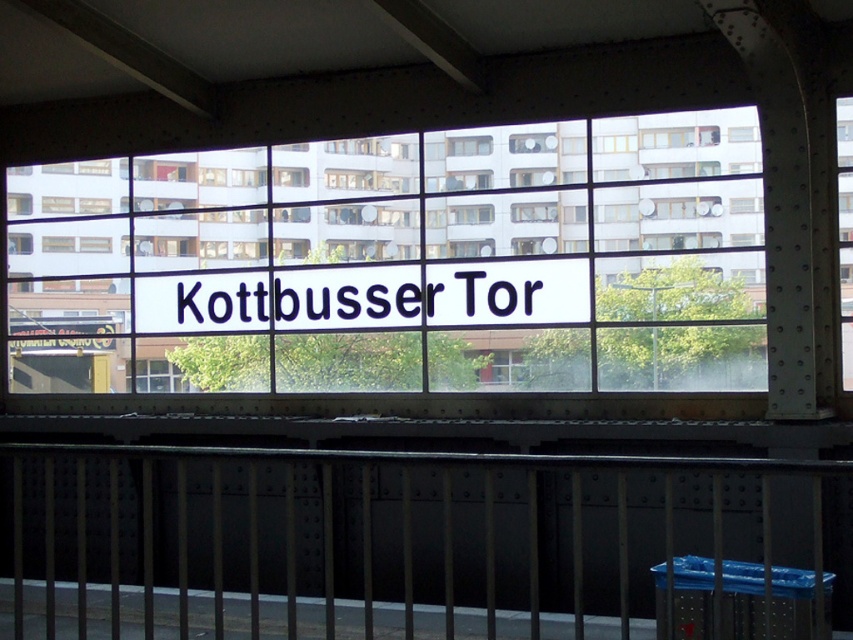
Is transparent glass sign at center above black metal rail at center?

Indeed, transparent glass sign at center is positioned over black metal rail at center.

Is point (24, 280) closer to camera compared to point (561, 580)?

No, it is behind (561, 580).

Locate an element on the screen. transparent glass sign at center is located at coordinates (393, 243).